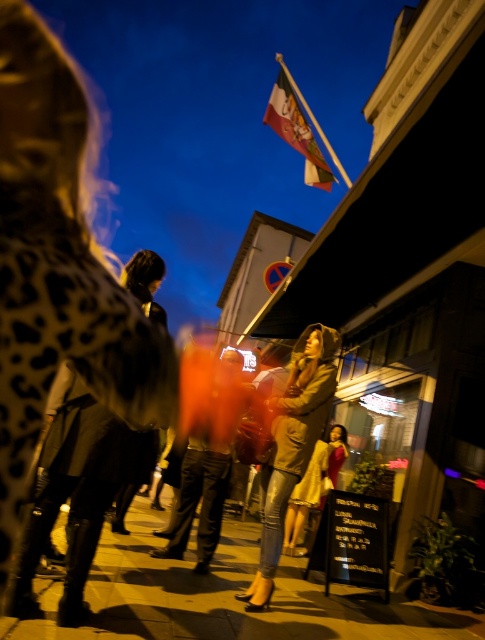
Question: Can you confirm if smooth concrete pavement at center is smaller than leather jacket at center?

Choices:
 (A) yes
 (B) no

Answer: (B)

Question: Based on their relative distances, which object is farther from the leather jacket at center?

Choices:
 (A) leopard print coat at center
 (B) smooth concrete pavement at center

Answer: (A)

Question: Is leopard print coat at center positioned at the back of smooth concrete pavement at center?

Choices:
 (A) no
 (B) yes

Answer: (A)

Question: Which point is closer to the camera?

Choices:
 (A) leather jacket at center
 (B) smooth concrete pavement at center
 (C) leopard print coat at center

Answer: (C)

Question: Does smooth concrete pavement at center appear on the right side of leather jacket at center?

Choices:
 (A) yes
 (B) no

Answer: (B)

Question: Which of these objects is positioned closest to the smooth concrete pavement at center?

Choices:
 (A) leopard print coat at center
 (B) leather jacket at center

Answer: (B)